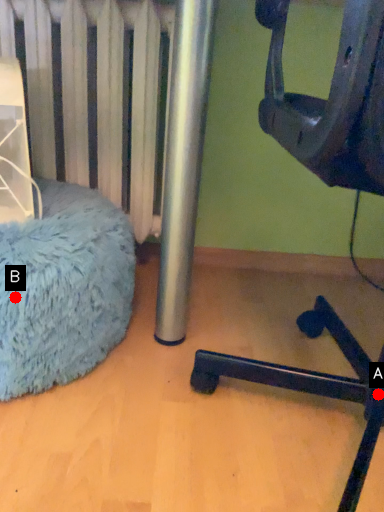
Question: Two points are circled on the image, labeled by A and B beside each circle. Which point is farther to the camera?

Choices:
 (A) A is further
 (B) B is further

Answer: (A)